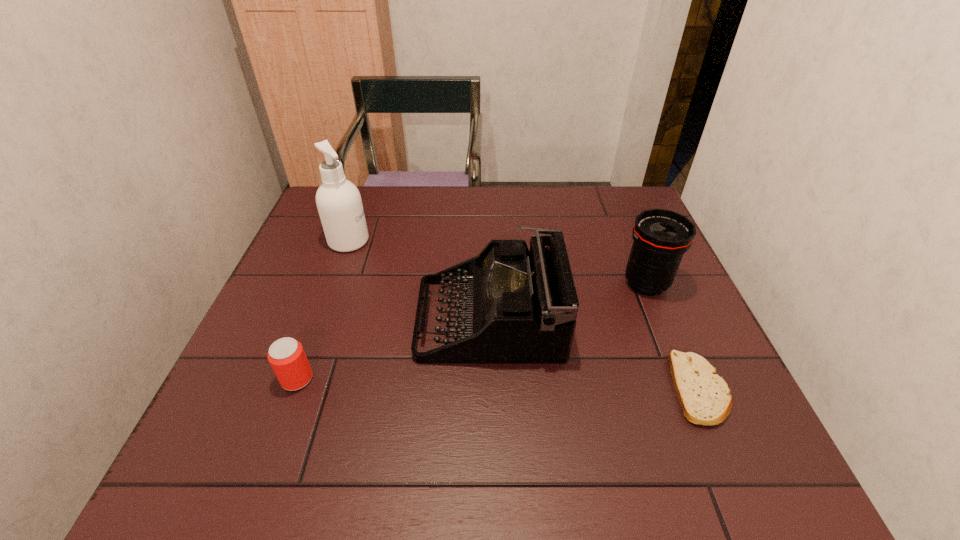
At what (x,y) coordinates should I click in order to perform the action: click on free location at the right edge of the desktop. Please return your answer as a coordinate pair (x, y). Image resolution: width=960 pixels, height=540 pixels. Looking at the image, I should click on (705, 357).

Where is `free point between the beer can and the tallest object`? This screenshot has height=540, width=960. free point between the beer can and the tallest object is located at coordinates (323, 310).

Where is `free space between the telephoto lens and the pita bread`? free space between the telephoto lens and the pita bread is located at coordinates (673, 336).

I want to click on empty space that is in between the third object from right to left and the shortest object, so click(x=594, y=353).

Find the location of `unoccupied position between the pita bread and the beer can`. unoccupied position between the pita bread and the beer can is located at coordinates click(x=498, y=384).

Where is `free point between the third object from left to right and the second shortest object`? The height and width of the screenshot is (540, 960). free point between the third object from left to right and the second shortest object is located at coordinates click(x=394, y=348).

Locate an element on the screen. Image resolution: width=960 pixels, height=540 pixels. empty space between the third object from left to right and the second shortest object is located at coordinates (394, 348).

Choose which object is the nearest neighbor to the cleansing agent. Please provide its 2D coordinates. Your answer should be formatted as a tuple, i.e. [(x, y)], where the tuple contains the x and y coordinates of a point satisfying the conditions above.

[(518, 306)]

Find the location of a particular element. The image size is (960, 540). object that is the fourth closest to the farthest object is located at coordinates (704, 396).

Locate an element on the screen. The width and height of the screenshot is (960, 540). free spot that satisfies the following two spatial constraints: 1. on the typing side of the typewriter; 2. on the left side of the pita bread is located at coordinates (491, 389).